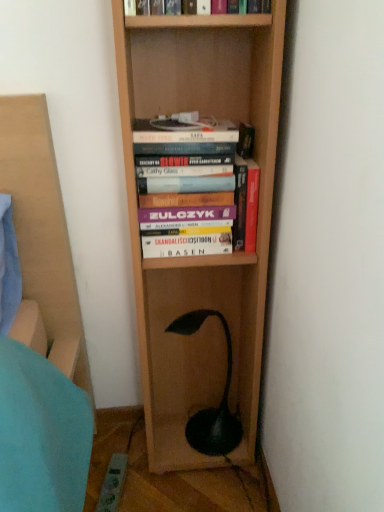
Locate an element on the screen. The image size is (384, 512). empty space that is ontop of hardcover books at center, the 2th book viewed from the top (from a real-world perspective) is located at coordinates click(181, 122).